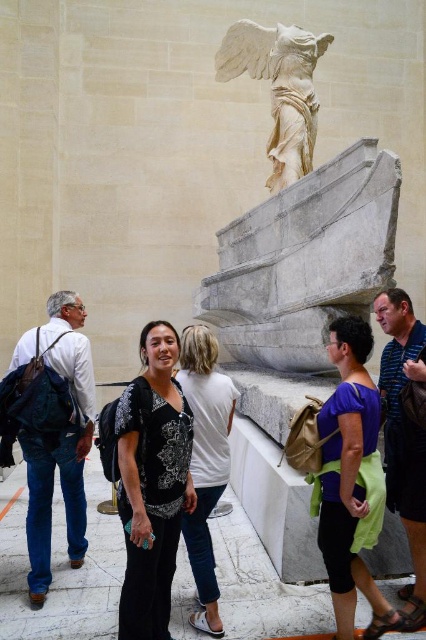
Question: Does black printed blouse at center have a smaller size compared to denim jeans at left?

Choices:
 (A) no
 (B) yes

Answer: (B)

Question: Considering the relative positions of denim jeans at left and white cotton shirt at center in the image provided, where is denim jeans at left located with respect to white cotton shirt at center?

Choices:
 (A) below
 (B) above

Answer: (A)

Question: Which point appears closest to the camera in this image?

Choices:
 (A) (351, 612)
 (B) (275, 49)
 (C) (150, 513)
 (D) (394, 314)

Answer: (A)

Question: Which point is closer to the camera?

Choices:
 (A) denim jeans at left
 (B) white cotton shirt at center

Answer: (B)

Question: Based on their relative distances, which object is nearer to the purple fabric at center?

Choices:
 (A) striped cotton shirt at center
 (B) black printed blouse at center
 (C) white cotton shirt at center

Answer: (A)

Question: Can you confirm if purple fabric at center is smaller than white marble winged statue at upper center?

Choices:
 (A) yes
 (B) no

Answer: (A)